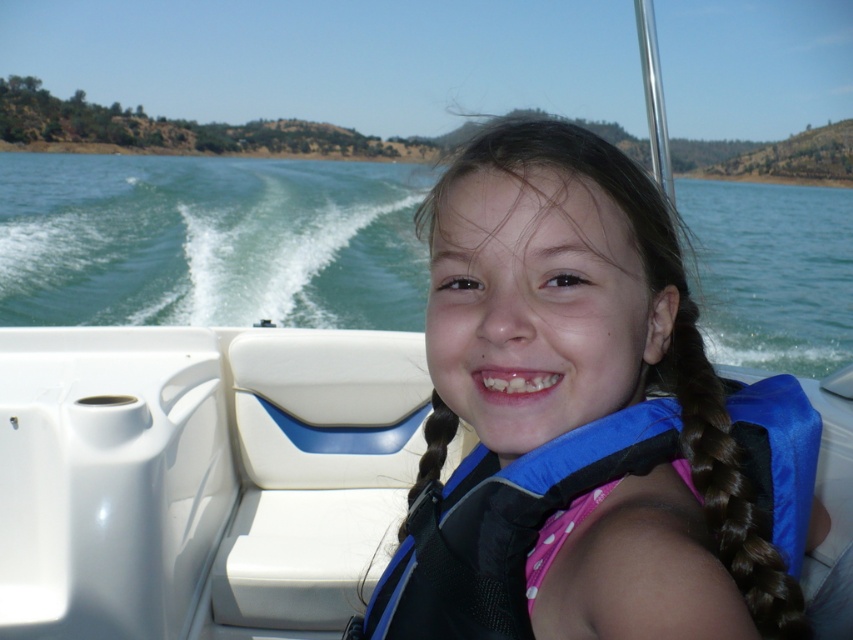
Which of these two, blue fabric life vest at center or white plastic boat at center, stands taller?

Standing taller between the two is white plastic boat at center.

Between blue fabric life vest at center and white plastic boat at center, which one is positioned lower?

white plastic boat at center is below.

Between point (676, 484) and point (120, 625), which one is positioned behind?

The point (120, 625) is behind.

Locate an element on the screen. This screenshot has height=640, width=853. blue fabric life vest at center is located at coordinates click(577, 417).

Does point (480, 550) come in front of point (682, 285)?

Yes, it is.

Is blue fabric life jacket at center bigger than brown silky hair at center?

Yes.

Measure the distance between blue fabric life jacket at center and camera.

blue fabric life jacket at center and camera are 27.61 inches apart.

This screenshot has height=640, width=853. What are the coordinates of `blue fabric life jacket at center` in the screenshot? It's located at (503, 525).

Can you confirm if white plastic boat at center is positioned to the right of brown silky hair at center?

Incorrect, white plastic boat at center is not on the right side of brown silky hair at center.

Is point (224, 536) closer to viewer compared to point (676, 324)?

No, it is not.

This screenshot has width=853, height=640. Identify the location of white plastic boat at center. (198, 476).